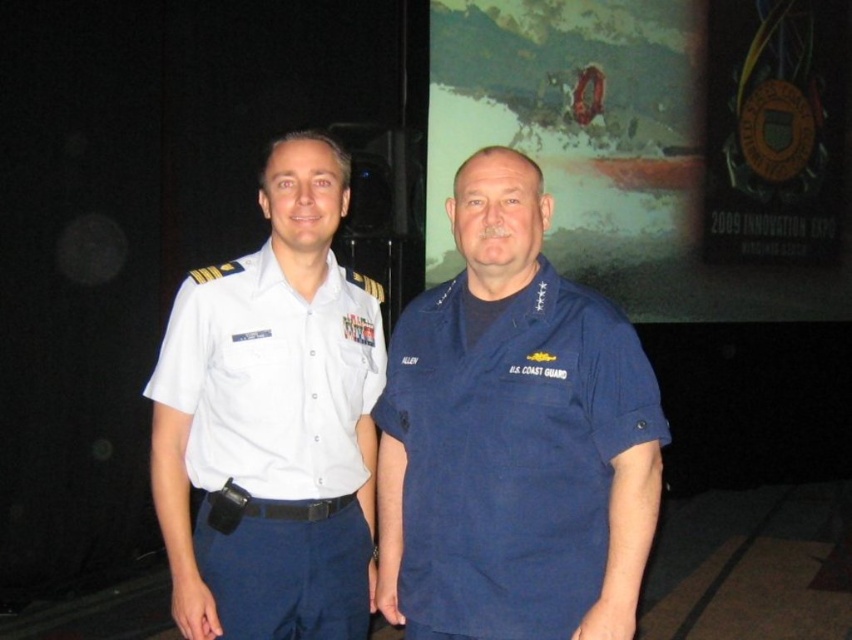
You are a tailor measuring the distance between two uniforms for a fitting. The navy blue fabric us coast guard uniform at center and the white cotton shirt at center are both on a mannequin. Can you fit a 12 inch ruler between them without moving the uniforms?

The navy blue fabric us coast guard uniform at center is 13.09 inches from the white cotton shirt at center. Since the distance is greater than 12 inches, the ruler can fit between them without moving the uniforms.

You are organizing a military event and need to ensure that all uniforms fit properly. Given the navy blue fabric US Coast Guard uniform at center and the white cotton shirt at center, which uniform has a wider torso measurement?

The navy blue fabric US Coast Guard uniform at center has a larger width than the white cotton shirt at center, so it has a wider torso measurement.